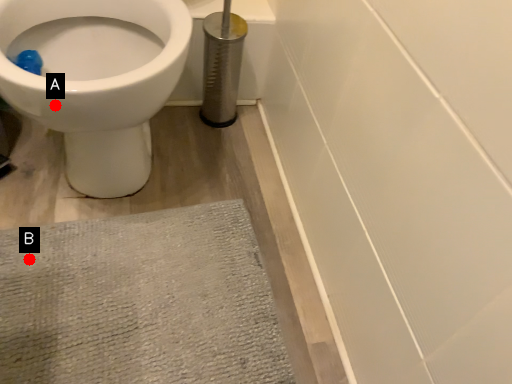
Question: Two points are circled on the image, labeled by A and B beside each circle. Which point appears closest to the camera in this image?

Choices:
 (A) A is closer
 (B) B is closer

Answer: (A)